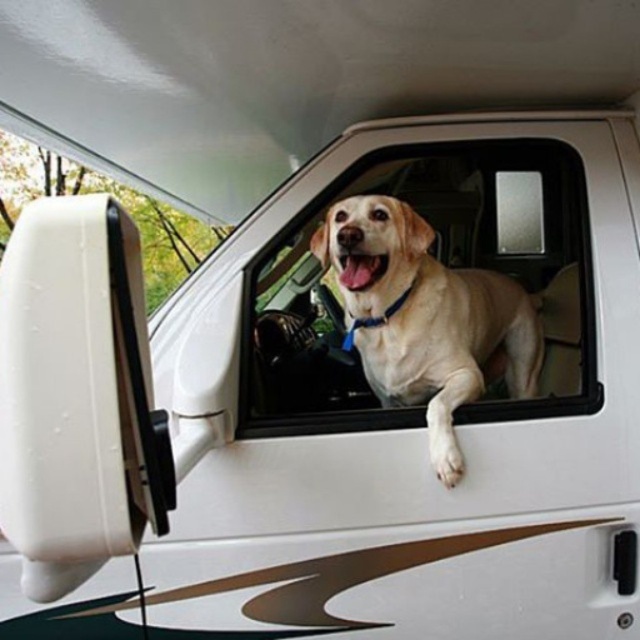
Question: Among these objects, which one is nearest to the camera?

Choices:
 (A) golden fur dog at center
 (B) light beige fabric car window at center

Answer: (A)

Question: Does light beige fabric car window at center have a smaller size compared to golden fur dog at center?

Choices:
 (A) no
 (B) yes

Answer: (A)

Question: Which point is closer to the camera?

Choices:
 (A) (420, 360)
 (B) (314, 404)

Answer: (A)

Question: Does light beige fabric car window at center appear on the right side of golden fur dog at center?

Choices:
 (A) yes
 (B) no

Answer: (B)

Question: From the image, what is the correct spatial relationship of light beige fabric car window at center in relation to golden fur dog at center?

Choices:
 (A) above
 (B) below

Answer: (A)